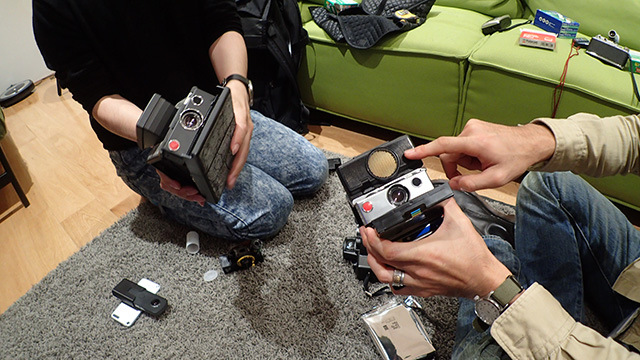
At what (x,y) coordinates should I click in order to perform the action: click on grey rug. Please return your answer as a coordinate pair (x, y). Looking at the image, I should click on (198, 331).